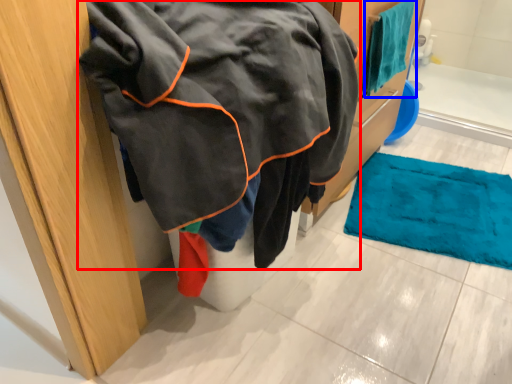
Question: Among these objects, which one is nearest to the camera, jacket (highlighted by a red box) or towel (highlighted by a blue box)?

Choices:
 (A) jacket
 (B) towel

Answer: (A)